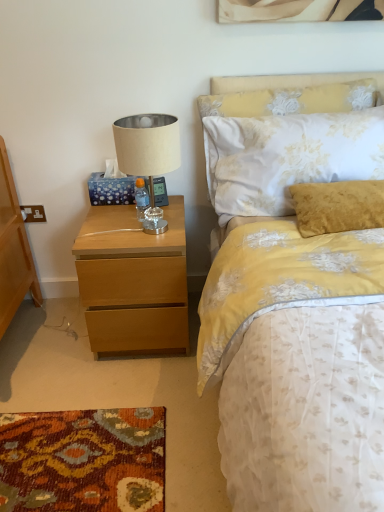
Where is `vacant region under beige fabric lampshade at upper left (from a real-world perspective)`? This screenshot has width=384, height=512. vacant region under beige fabric lampshade at upper left (from a real-world perspective) is located at coordinates click(150, 228).